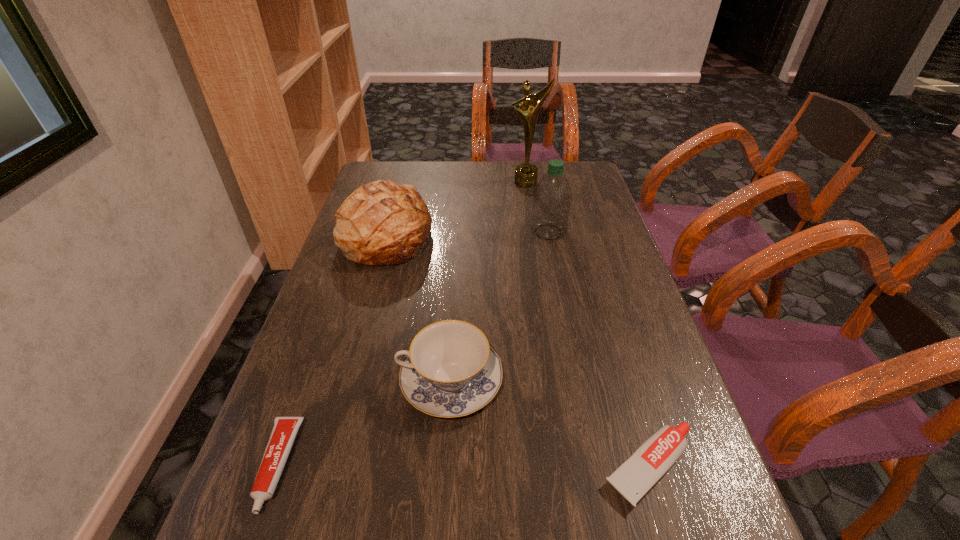
At what (x,y) coordinates should I click in order to perform the action: click on object that is the third closest to the farthest object. Please return your answer as a coordinate pair (x, y). The width and height of the screenshot is (960, 540). Looking at the image, I should click on (450, 370).

Locate an element on the screen. This screenshot has width=960, height=540. the fifth closest object relative to the water bottle is located at coordinates (284, 431).

Choose which toothpaste is the nearest neighbor to the bread. Please provide its 2D coordinates. Your answer should be formatted as a tuple, i.e. [(x, y)], where the tuple contains the x and y coordinates of a point satisfying the conditions above.

[(284, 431)]

This screenshot has width=960, height=540. Identify the location of free space that satisfies the following two spatial constraints: 1. on the front-facing side of the award; 2. on the left side of the water bottle. (535, 232).